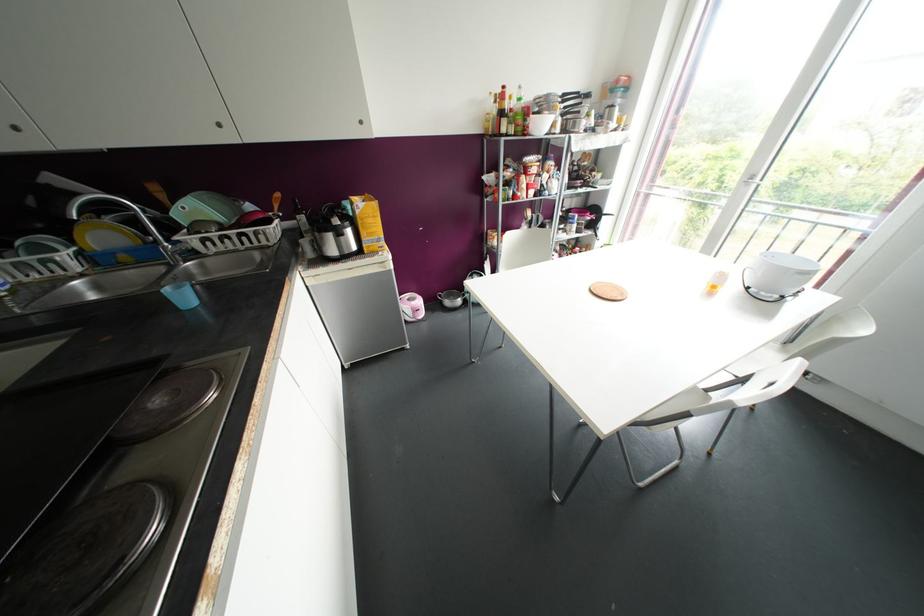
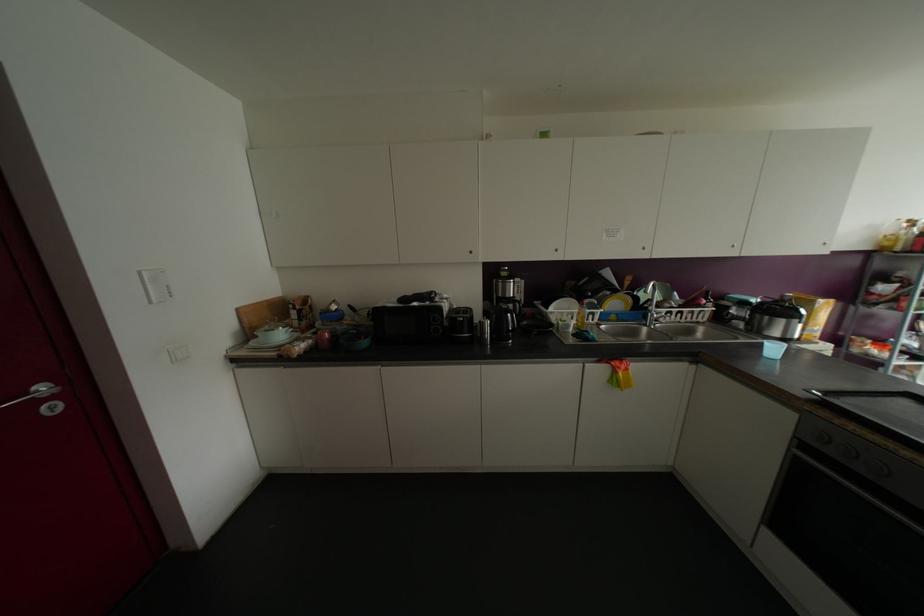
Find the pixel in the second image that matches pixel 103 236 in the first image.

(614, 302)